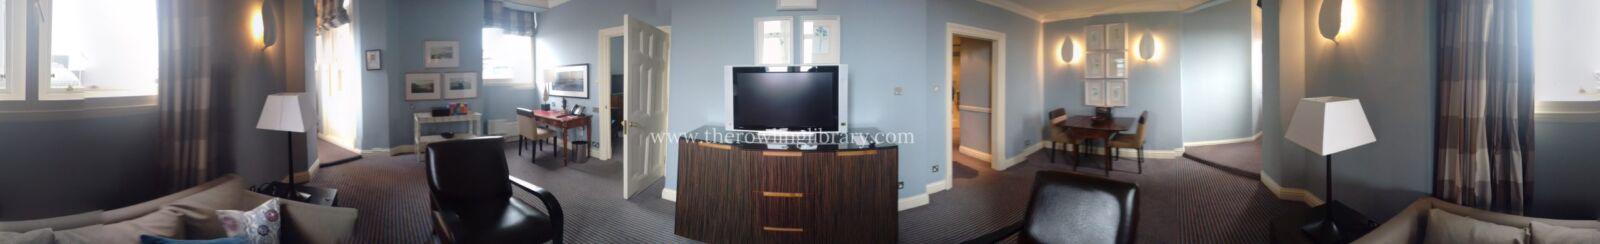
Identify the location of sofas. (232, 199), (1435, 225).